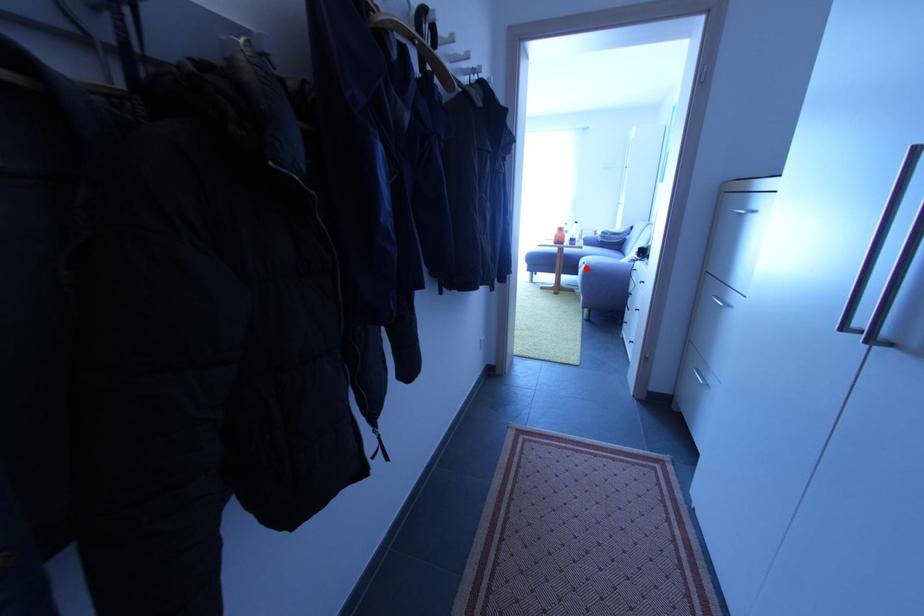
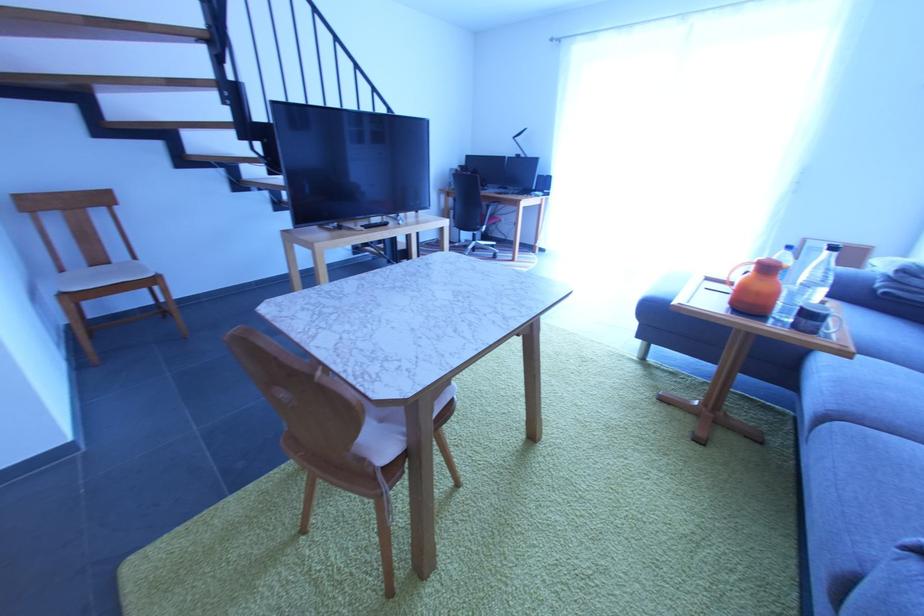
Locate, in the second image, the point that corresponds to the highlighted location in the first image.

(833, 419)